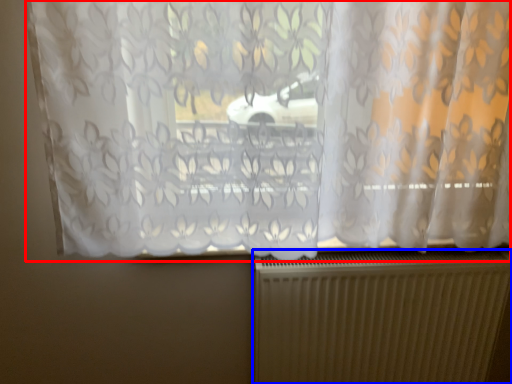
Question: Among these objects, which one is farthest to the camera, curtain (highlighted by a red box) or radiator (highlighted by a blue box)?

Choices:
 (A) curtain
 (B) radiator

Answer: (B)